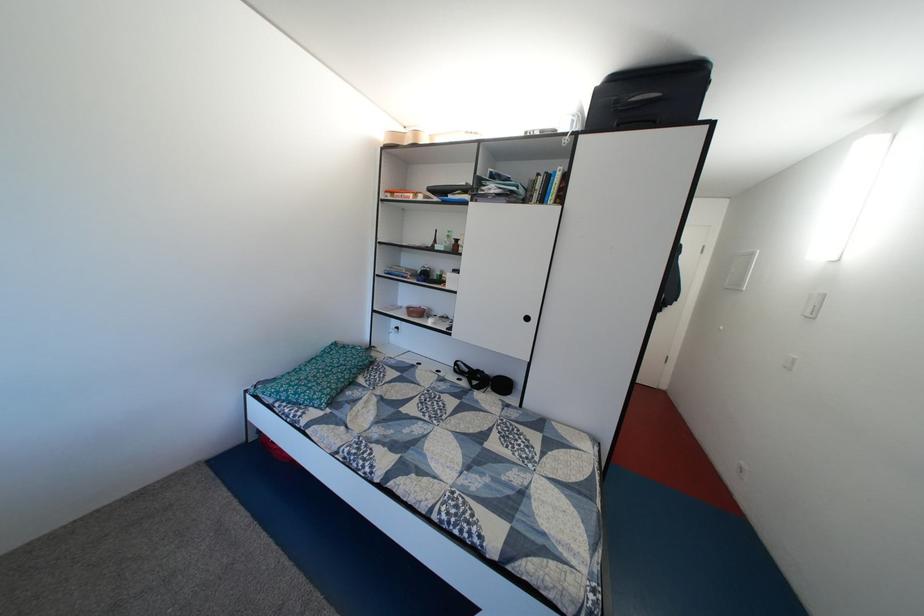
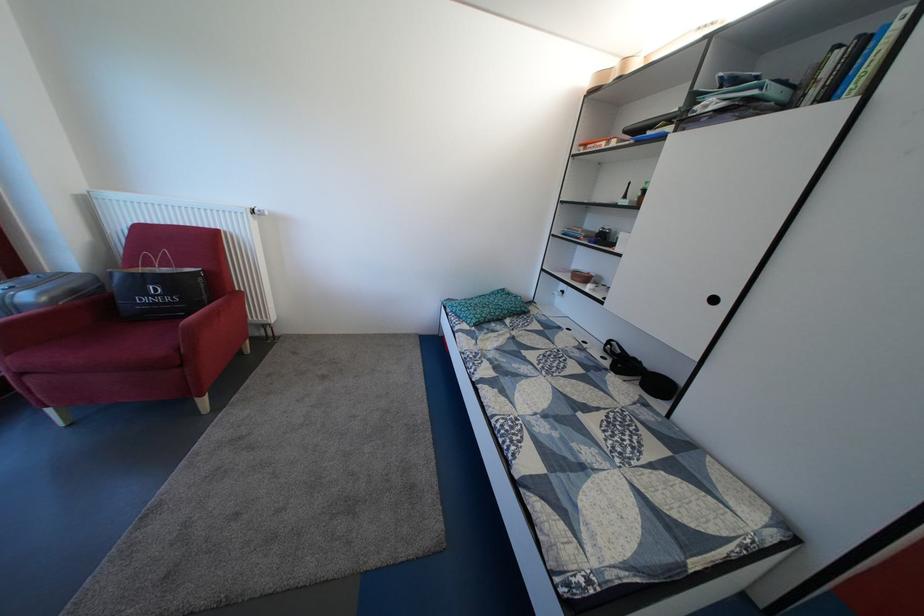
The point at [403,315] is marked in the first image. Where is the corresponding point in the second image?

(570, 278)